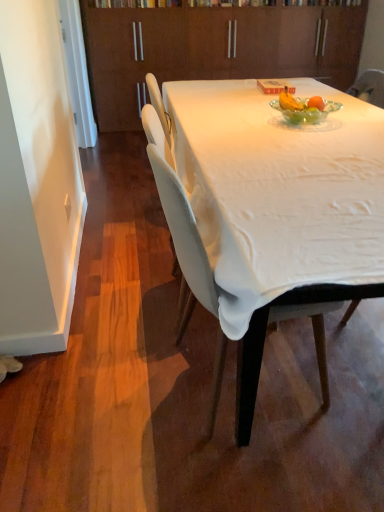
What is the approximate height of brown wood cabinetry at upper center?

brown wood cabinetry at upper center is 4.27 feet in height.

Consider the image. Measure the distance between point [213,405] and camera.

The distance of point [213,405] from camera is 4.96 feet.

Image resolution: width=384 pixels, height=512 pixels. Find the location of `brown wood cabinetry at upper center`. brown wood cabinetry at upper center is located at coordinates (213, 47).

Is brown wood cabinetry at upper center at the back of white fabric chair at center?

white fabric chair at center does not have its back to brown wood cabinetry at upper center.

Which is closer to the camera, (172, 208) or (231, 67)?

Point (172, 208) is positioned closer to the camera compared to point (231, 67).

From the image's perspective, which one is positioned higher, white fabric chair at center or brown wood cabinetry at upper center?

brown wood cabinetry at upper center is shown above in the image.

Is white fabric chair at center inside the boundaries of brown wood cabinetry at upper center, or outside?

white fabric chair at center cannot be found inside brown wood cabinetry at upper center.

Which of these two, white cloth-covered table at center or white fabric chair at center, stands taller?

With more height is white fabric chair at center.

Does white cloth-covered table at center turn towards white fabric chair at center?

No, white cloth-covered table at center does not turn towards white fabric chair at center.

Is point (247, 80) positioned in front of point (173, 200)?

No, (247, 80) is behind (173, 200).

How many degrees apart are the facing directions of white cloth-covered table at center and white fabric chair at center?

They differ by 8.4 degrees in their facing directions.

Does white fabric chair at center have a smaller size compared to white cloth-covered table at center?

Yes, white fabric chair at center is smaller than white cloth-covered table at center.

Can you confirm if white fabric chair at center is taller than white cloth-covered table at center?

Yes, white fabric chair at center is taller than white cloth-covered table at center.

Consider the image. Considering the sizes of white fabric chair at center and white cloth-covered table at center in the image, is white fabric chair at center wider or thinner than white cloth-covered table at center?

→ Clearly, white fabric chair at center has less width compared to white cloth-covered table at center.

Looking at this image, would you say white fabric chair at center is to the left or to the right of white cloth-covered table at center in the picture?

From the image, it's evident that white fabric chair at center is to the left of white cloth-covered table at center.

Which is farther, [359,136] or [99,29]?

The point [99,29] is farther from the camera.

Considering the positions of objects white cloth-covered table at center and brown wood cabinetry at upper center in the image provided, who is more to the right, white cloth-covered table at center or brown wood cabinetry at upper center?

Positioned to the right is white cloth-covered table at center.

Looking at this image, from a real-world perspective, is white cloth-covered table at center on brown wood cabinetry at upper center?

No.

Considering the relative positions of white cloth-covered table at center and brown wood cabinetry at upper center in the image provided, is white cloth-covered table at center behind brown wood cabinetry at upper center?

No, white cloth-covered table at center is closer to the viewer.

Do you think brown wood cabinetry at upper center is within white fabric chair at center, or outside of it?

brown wood cabinetry at upper center lies outside white fabric chair at center.

Could you tell me if brown wood cabinetry at upper center is facing white fabric chair at center?

Yes, brown wood cabinetry at upper center is aimed at white fabric chair at center.

Are brown wood cabinetry at upper center and white fabric chair at center located far from each other?

Yes, brown wood cabinetry at upper center and white fabric chair at center are located far from each other.

The width and height of the screenshot is (384, 512). I want to click on desk on the right of brown wood cabinetry at upper center, so click(279, 191).

Is white cloth-covered table at center inside brown wood cabinetry at upper center?

No, white cloth-covered table at center is not surrounded by brown wood cabinetry at upper center.

Can you tell me how much brown wood cabinetry at upper center and white cloth-covered table at center differ in facing direction?

There is a 89.3-degree angle between the facing directions of brown wood cabinetry at upper center and white cloth-covered table at center.

Is brown wood cabinetry at upper center to the left or to the right of white cloth-covered table at center in the image?

brown wood cabinetry at upper center is to the left of white cloth-covered table at center.

Image resolution: width=384 pixels, height=512 pixels. I want to click on chair in front of the brown wood cabinetry at upper center, so click(x=183, y=242).

Identify the location of desk that is above the white fabric chair at center (from a real-world perspective). (279, 191).

When comparing their distances from brown wood cabinetry at upper center, does white fabric chair at center or white cloth-covered table at center seem further?

white fabric chair at center.

Consider the image. Based on their spatial positions, is white cloth-covered table at center or brown wood cabinetry at upper center closer to white fabric chair at center?

Based on the image, white cloth-covered table at center appears to be nearer to white fabric chair at center.

Considering their positions, is white cloth-covered table at center positioned closer to brown wood cabinetry at upper center than white fabric chair at center?

white cloth-covered table at center is closer to brown wood cabinetry at upper center.

From the image, which object appears to be farther from white cloth-covered table at center, white fabric chair at center or brown wood cabinetry at upper center?

brown wood cabinetry at upper center is further to white cloth-covered table at center.

Looking at the image, which one is located closer to white fabric chair at center, brown wood cabinetry at upper center or white cloth-covered table at center?

white cloth-covered table at center is closer to white fabric chair at center.

Which object lies further to the anchor point white cloth-covered table at center, brown wood cabinetry at upper center or white fabric chair at center?

Among the two, brown wood cabinetry at upper center is located further to white cloth-covered table at center.

The width and height of the screenshot is (384, 512). In order to click on chair located between white cloth-covered table at center and brown wood cabinetry at upper center in the depth direction in this screenshot , I will do `click(183, 242)`.